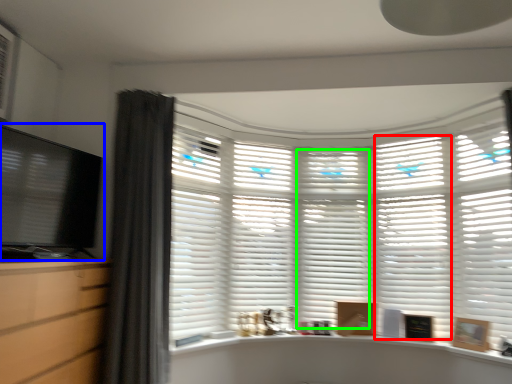
Question: Based on their relative distances, which object is nearer to shutter (highlighted by a red box)? Choose from computer monitor (highlighted by a blue box) and shutter (highlighted by a green box).

Choices:
 (A) computer monitor
 (B) shutter

Answer: (B)